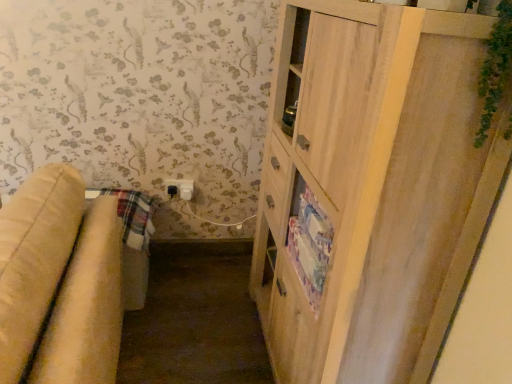
Question: Is light wood cabinet at right turned away from white plastic electric outlet at lower center?

Choices:
 (A) yes
 (B) no

Answer: (B)

Question: From a real-world perspective, is light wood cabinet at right physically above white plastic electric outlet at lower center?

Choices:
 (A) no
 (B) yes

Answer: (B)

Question: Could you tell me if light wood cabinet at right is facing white plastic electric outlet at lower center?

Choices:
 (A) no
 (B) yes

Answer: (A)

Question: Does light wood cabinet at right have a smaller size compared to white plastic electric outlet at lower center?

Choices:
 (A) yes
 (B) no

Answer: (B)

Question: Does light wood cabinet at right lie behind white plastic electric outlet at lower center?

Choices:
 (A) no
 (B) yes

Answer: (A)

Question: Is light wood cabinet at right spatially inside white plastic electric outlet at lower center, or outside of it?

Choices:
 (A) outside
 (B) inside

Answer: (A)

Question: From a real-world perspective, relative to white plastic electric outlet at lower center, is light wood cabinet at right vertically above or below?

Choices:
 (A) above
 (B) below

Answer: (A)

Question: From the image's perspective, relative to white plastic electric outlet at lower center, is light wood cabinet at right above or below?

Choices:
 (A) above
 (B) below

Answer: (B)

Question: Is light wood cabinet at right taller or shorter than white plastic electric outlet at lower center?

Choices:
 (A) short
 (B) tall

Answer: (B)

Question: In the image, is white plastic electric outlet at lower center positioned in front of or behind beige fabric studio couch at left?

Choices:
 (A) behind
 (B) front

Answer: (A)

Question: Is white plastic electric outlet at lower center taller or shorter than beige fabric studio couch at left?

Choices:
 (A) tall
 (B) short

Answer: (B)

Question: Is white plastic electric outlet at lower center spatially inside beige fabric studio couch at left, or outside of it?

Choices:
 (A) inside
 (B) outside

Answer: (B)

Question: Is point (175, 192) positioned closer to the camera than point (83, 213)?

Choices:
 (A) farther
 (B) closer

Answer: (A)

Question: Choose the correct answer: Is beige fabric studio couch at left inside light wood cabinet at right or outside it?

Choices:
 (A) outside
 (B) inside

Answer: (A)

Question: In the image, is beige fabric studio couch at left positioned in front of or behind light wood cabinet at right?

Choices:
 (A) behind
 (B) front

Answer: (B)